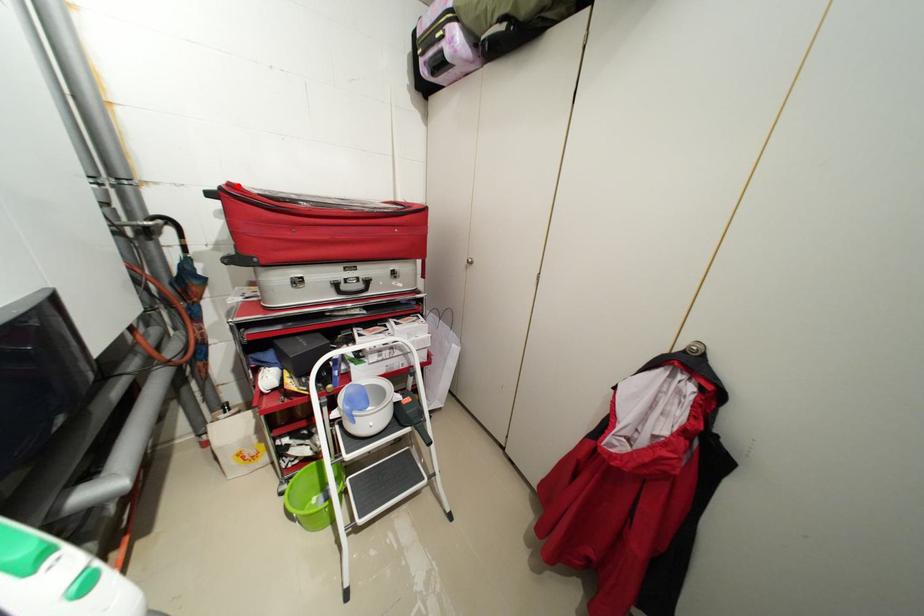
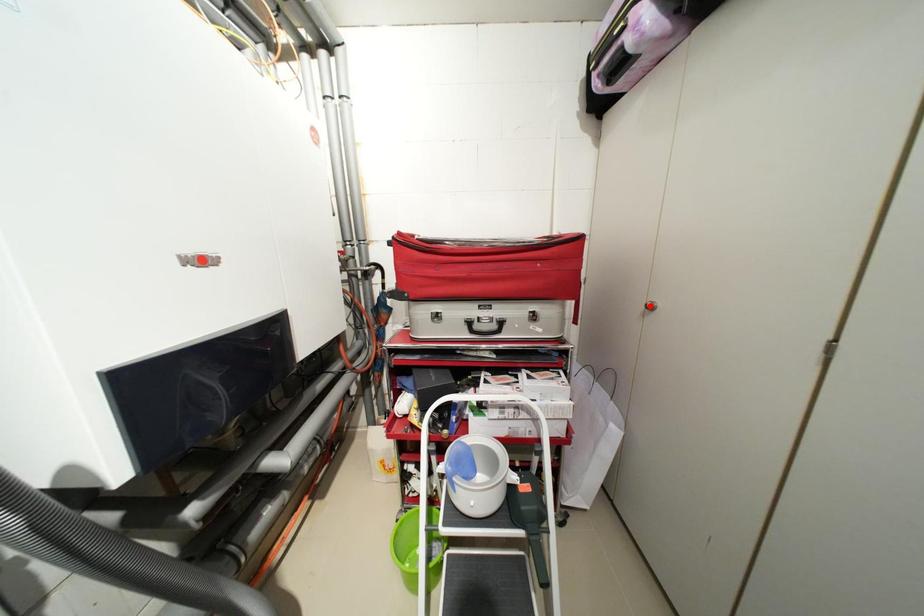
In the scene shown: I am providing you with two images of the same scene from different viewpoints. A red point is marked on the first image and another point is marked on the second image. Is the red point in image1 aligned with the point shown in image2?

No